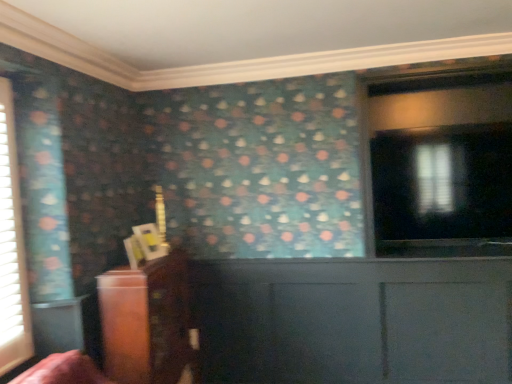
Question: Considering the relative sizes of wooden cabinet at left and white textured blinds at left in the image provided, is wooden cabinet at left thinner than white textured blinds at left?

Choices:
 (A) yes
 (B) no

Answer: (B)

Question: Is wooden cabinet at left shorter than white textured blinds at left?

Choices:
 (A) no
 (B) yes

Answer: (B)

Question: Is wooden cabinet at left closer to the viewer compared to white textured blinds at left?

Choices:
 (A) yes
 (B) no

Answer: (B)

Question: Would you say white textured blinds at left is part of wooden cabinet at left's contents?

Choices:
 (A) no
 (B) yes

Answer: (A)

Question: Does wooden cabinet at left appear on the right side of white textured blinds at left?

Choices:
 (A) no
 (B) yes

Answer: (B)

Question: Is point (4, 100) positioned closer to the camera than point (475, 183)?

Choices:
 (A) farther
 (B) closer

Answer: (B)

Question: In the image, is white textured blinds at left on the left side or the right side of transparent glass window at upper right?

Choices:
 (A) left
 (B) right

Answer: (A)

Question: From the image's perspective, relative to transparent glass window at upper right, is white textured blinds at left above or below?

Choices:
 (A) below
 (B) above

Answer: (A)

Question: In the image, is white textured blinds at left positioned in front of or behind transparent glass window at upper right?

Choices:
 (A) front
 (B) behind

Answer: (A)

Question: Is wooden cabinet at left spatially inside transparent glass window at upper right, or outside of it?

Choices:
 (A) inside
 (B) outside

Answer: (B)

Question: Considering the positions of point (131, 370) and point (460, 155), is point (131, 370) closer or farther from the camera than point (460, 155)?

Choices:
 (A) closer
 (B) farther

Answer: (A)

Question: Considering their positions, is wooden cabinet at left located in front of or behind transparent glass window at upper right?

Choices:
 (A) behind
 (B) front

Answer: (B)

Question: In terms of width, does wooden cabinet at left look wider or thinner when compared to transparent glass window at upper right?

Choices:
 (A) thin
 (B) wide

Answer: (B)

Question: Is white textured blinds at left inside the boundaries of wooden cabinet at left, or outside?

Choices:
 (A) inside
 (B) outside

Answer: (B)

Question: In terms of size, does white textured blinds at left appear bigger or smaller than wooden cabinet at left?

Choices:
 (A) small
 (B) big

Answer: (A)